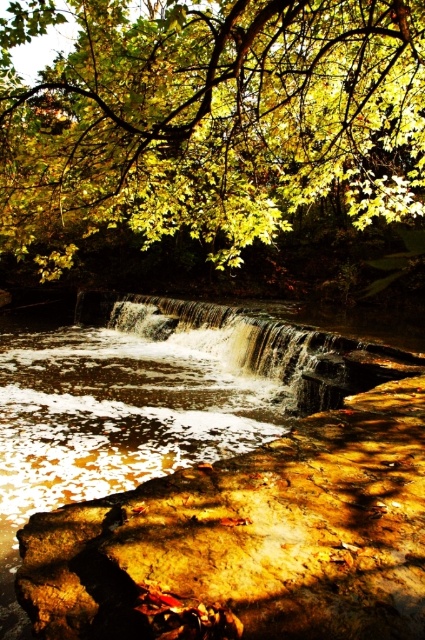
You are standing at the base of the waterfall in the scene. You notice two points marked in the image. One is at coordinates point (x=266, y=182) and the other at point (x=260, y=323). Which point is closer to you when you are facing the waterfall?

Point (x=260, y=323) is closer to you because point (x=266, y=182) is behind point (x=260, y=323).